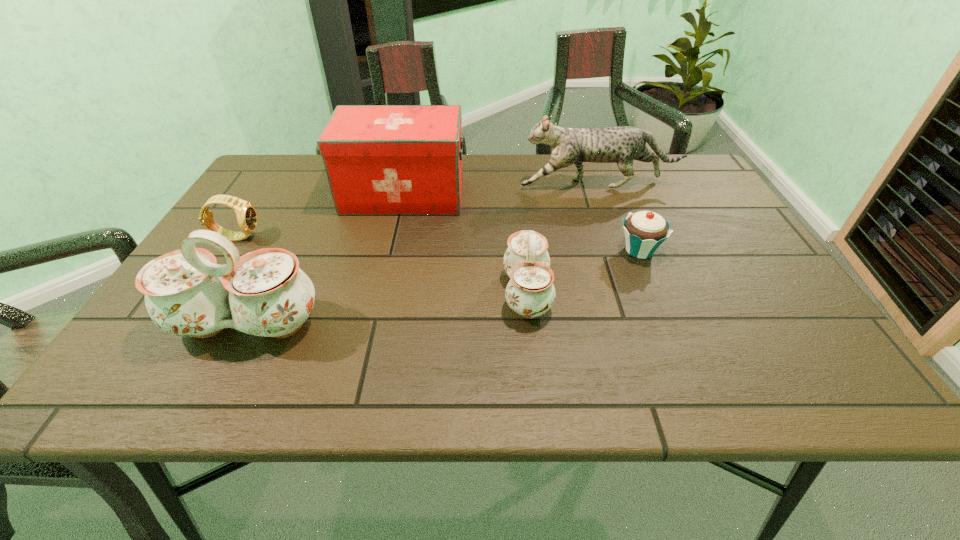
This screenshot has width=960, height=540. What are the coordinates of `the left chinaware` in the screenshot? It's located at (264, 293).

Find the location of `the shorter chinaware`. the shorter chinaware is located at coordinates (530, 292).

Identify the location of the third shortest object. The image size is (960, 540). (530, 292).

Find the location of a particular element. the first-aid kit is located at coordinates (x=379, y=159).

You are a GUI agent. You are given a task and a screenshot of the screen. Output one action in this format:
    pyautogui.click(x=<x>, y=<y>)
    Task: Click on the cat
    
    Given the screenshot: What is the action you would take?
    pyautogui.click(x=623, y=144)

Locate an element on the screen. watch is located at coordinates (246, 214).

Locate an element on the screen. The height and width of the screenshot is (540, 960). cupcake is located at coordinates (645, 231).

Where is `free space located 0.400m by the handle of the third shortest object`? free space located 0.400m by the handle of the third shortest object is located at coordinates (316, 293).

The width and height of the screenshot is (960, 540). Find the location of `free spot located by the handle of the third shortest object`. free spot located by the handle of the third shortest object is located at coordinates (419, 293).

At what (x,y) coordinates should I click in order to perform the action: click on vacant space situated 0.100m by the handle of the third shortest object. Please return your answer as a coordinate pair (x, y). Image resolution: width=960 pixels, height=540 pixels. Looking at the image, I should click on (456, 293).